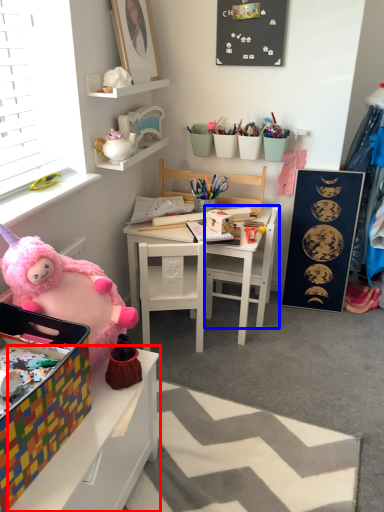
Question: Among these objects, which one is farthest to the camera, table (highlighted by a red box) or chair (highlighted by a blue box)?

Choices:
 (A) table
 (B) chair

Answer: (B)